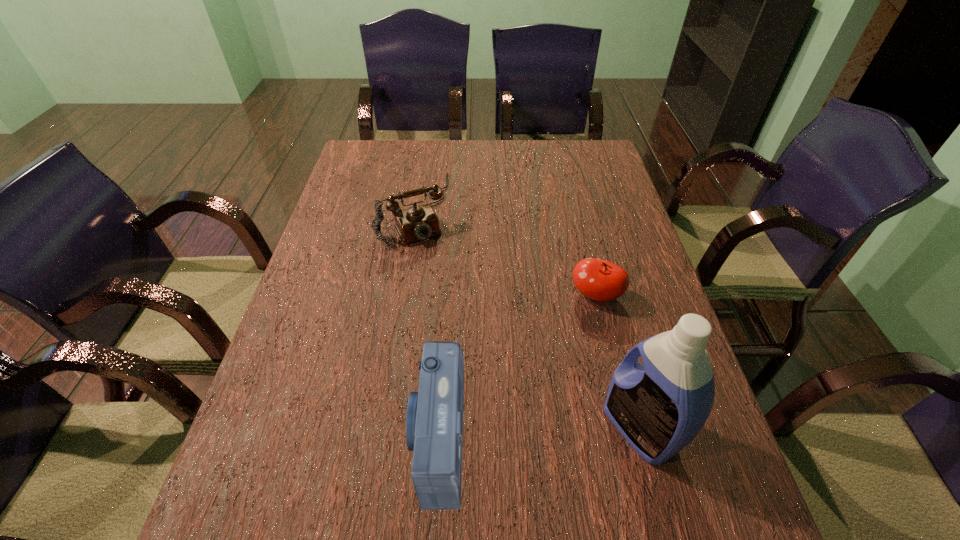
Locate an element on the screen. empty space between the apple and the farthest object is located at coordinates (505, 252).

The width and height of the screenshot is (960, 540). I want to click on free area in between the camera and the tallest object, so click(539, 433).

Where is `vacant space that's between the camera and the telephone`? The height and width of the screenshot is (540, 960). vacant space that's between the camera and the telephone is located at coordinates (426, 322).

Where is `free space between the apple and the camera`? free space between the apple and the camera is located at coordinates (516, 366).

At what (x,y) coordinates should I click in order to perform the action: click on unoccupied area between the tallest object and the apple. Please return your answer as a coordinate pair (x, y). Looking at the image, I should click on (617, 362).

The image size is (960, 540). In order to click on unoccupied area between the farthest object and the camera in this screenshot , I will do `click(426, 322)`.

Identify the location of vacant space that's between the third nearest object and the telephone. (505, 252).

This screenshot has height=540, width=960. Identify the location of free point between the farthest object and the second farthest object. (505, 252).

At what (x,y) coordinates should I click in order to perform the action: click on object that stands as the closest to the camera. Please return your answer as a coordinate pair (x, y). This screenshot has width=960, height=540. Looking at the image, I should click on point(659,407).

I want to click on the closest object to the camera, so click(659, 407).